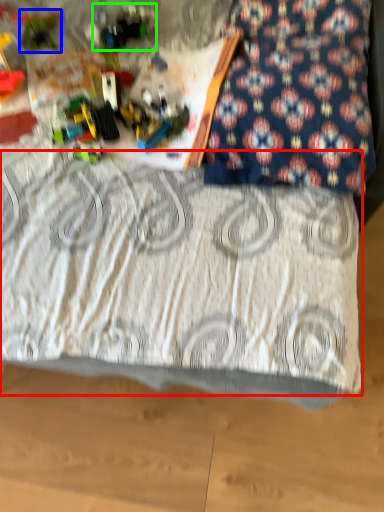
Question: Based on their relative distances, which object is nearer to bedding (highlighted by a red box)? Choose from toy (highlighted by a blue box) and toy (highlighted by a green box).

Choices:
 (A) toy
 (B) toy

Answer: (B)